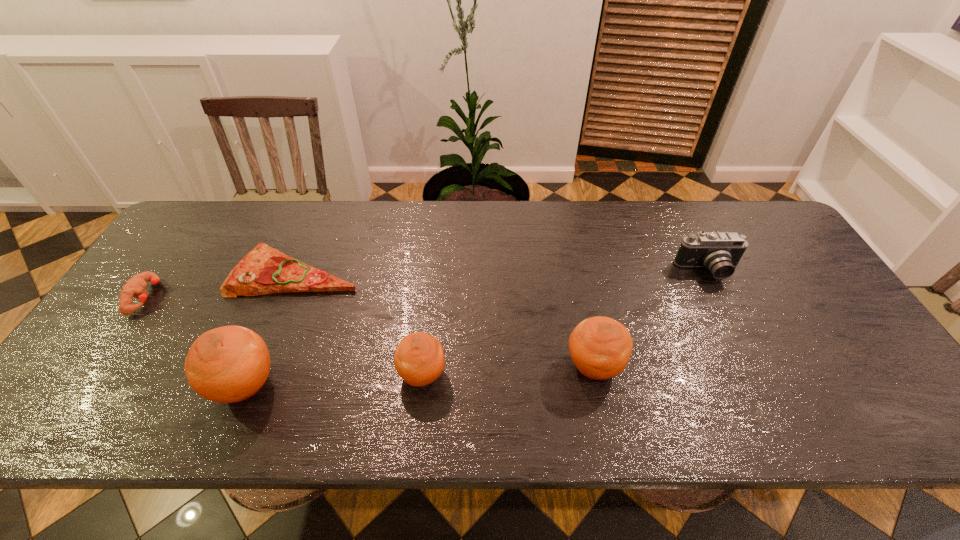
This screenshot has width=960, height=540. What are the coordinates of `the closest orange to the second shortest orange` in the screenshot? It's located at (419, 360).

This screenshot has width=960, height=540. I want to click on free point that satisfies the following two spatial constraints: 1. on the back side of the second tallest orange; 2. with the gloves of the second shortest object facing forward, so pyautogui.click(x=580, y=297).

I want to click on vacant space that satisfies the following two spatial constraints: 1. with the gloves of the puncher facing forward; 2. on the right side of the shortest orange, so click(x=92, y=375).

Find the location of a particular element. vacant space that satisfies the following two spatial constraints: 1. with the gloves of the leftmost object facing forward; 2. on the back side of the leftmost orange is located at coordinates (85, 384).

Where is `vacant space that satisfies the following two spatial constraints: 1. with the gloves of the shortest orange facing forward; 2. on the left side of the leftmost object`? vacant space that satisfies the following two spatial constraints: 1. with the gloves of the shortest orange facing forward; 2. on the left side of the leftmost object is located at coordinates (92, 375).